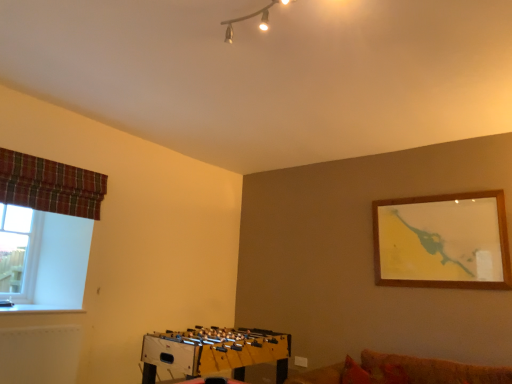
Question: Does wooden foosball table at lower center have a greater width compared to metallic track lighting at upper center?

Choices:
 (A) yes
 (B) no

Answer: (A)

Question: From the image's perspective, does wooden foosball table at lower center appear lower than metallic track lighting at upper center?

Choices:
 (A) yes
 (B) no

Answer: (A)

Question: Does wooden foosball table at lower center have a greater height compared to metallic track lighting at upper center?

Choices:
 (A) no
 (B) yes

Answer: (B)

Question: Would you say wooden foosball table at lower center is outside metallic track lighting at upper center?

Choices:
 (A) yes
 (B) no

Answer: (A)

Question: Is wooden foosball table at lower center smaller than metallic track lighting at upper center?

Choices:
 (A) no
 (B) yes

Answer: (A)

Question: Relative to metallic track lighting at upper center, is plaid fabric curtain at left in front or behind?

Choices:
 (A) behind
 (B) front

Answer: (A)

Question: From a real-world perspective, is plaid fabric curtain at left physically located above or below metallic track lighting at upper center?

Choices:
 (A) below
 (B) above

Answer: (A)

Question: Would you say plaid fabric curtain at left is to the left or to the right of metallic track lighting at upper center in the picture?

Choices:
 (A) left
 (B) right

Answer: (A)

Question: Is point (76, 187) closer or farther from the camera than point (262, 26)?

Choices:
 (A) closer
 (B) farther

Answer: (B)

Question: From a real-world perspective, is metallic track lighting at upper center positioned above or below clear glass window at left?

Choices:
 (A) above
 (B) below

Answer: (A)

Question: Is metallic track lighting at upper center inside or outside of clear glass window at left?

Choices:
 (A) inside
 (B) outside

Answer: (B)

Question: From the image's perspective, relative to clear glass window at left, is metallic track lighting at upper center above or below?

Choices:
 (A) below
 (B) above

Answer: (B)

Question: Would you say metallic track lighting at upper center is to the left or to the right of clear glass window at left in the picture?

Choices:
 (A) left
 (B) right

Answer: (B)

Question: Is metallic track lighting at upper center situated inside plaid fabric curtain at left or outside?

Choices:
 (A) outside
 (B) inside

Answer: (A)

Question: From the image's perspective, is metallic track lighting at upper center located above or below plaid fabric curtain at left?

Choices:
 (A) below
 (B) above

Answer: (B)